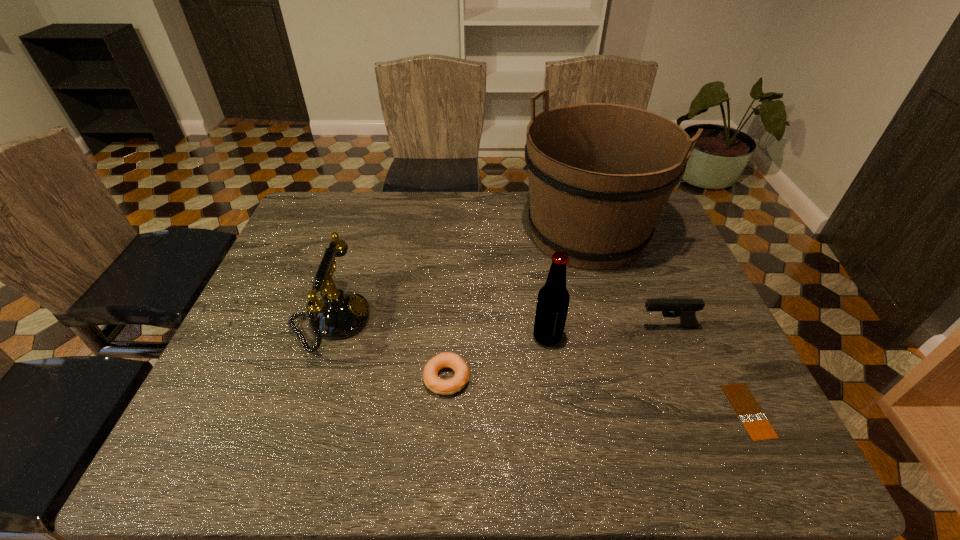
You are a GUI agent. You are given a task and a screenshot of the screen. Output one action in this format:
    pyautogui.click(x=<x>, y=<y>)
    Task: Click on the bucket located at the right edge
    
    Given the screenshot: What is the action you would take?
    pyautogui.click(x=600, y=174)

Locate an element on the screen. The width and height of the screenshot is (960, 540). pistol at the right edge is located at coordinates (685, 309).

This screenshot has height=540, width=960. In order to click on chocolate bar situated at the right edge in this screenshot , I will do `click(751, 415)`.

Locate an element on the screen. The width and height of the screenshot is (960, 540). object located in the far right corner section of the desktop is located at coordinates (600, 174).

Where is `object at the near right corner`? This screenshot has height=540, width=960. object at the near right corner is located at coordinates (751, 415).

Find the location of `vacant area at the far edge of the desktop`. vacant area at the far edge of the desktop is located at coordinates (393, 198).

The image size is (960, 540). In the image, there is a desktop. What are the coordinates of `vacant area at the near edge` in the screenshot? It's located at point(538,431).

The image size is (960, 540). I want to click on vacant region at the left edge of the desktop, so click(283, 280).

Find the location of `free region at the right edge of the desktop`. free region at the right edge of the desktop is located at coordinates (671, 284).

Locate an element on the screen. Image resolution: width=960 pixels, height=540 pixels. free space at the far left corner of the desktop is located at coordinates (348, 206).